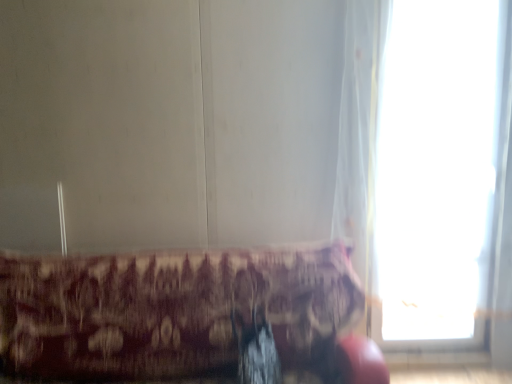
Question: Considering the positions of patterned fabric cushion at lower center and transparent glass window at right in the image, is patterned fabric cushion at lower center wider or thinner than transparent glass window at right?

Choices:
 (A) wide
 (B) thin

Answer: (A)

Question: Is patterned fabric cushion at lower center in front of or behind transparent glass window at right in the image?

Choices:
 (A) behind
 (B) front

Answer: (B)

Question: Considering the positions of patterned fabric cushion at lower center and transparent glass window at right in the image, is patterned fabric cushion at lower center bigger or smaller than transparent glass window at right?

Choices:
 (A) small
 (B) big

Answer: (B)

Question: Relative to patterned fabric cushion at lower center, is transparent glass window at right in front or behind?

Choices:
 (A) behind
 (B) front

Answer: (A)

Question: Considering the positions of transparent glass window at right and patterned fabric cushion at lower center in the image, is transparent glass window at right taller or shorter than patterned fabric cushion at lower center?

Choices:
 (A) short
 (B) tall

Answer: (B)

Question: From a real-world perspective, is transparent glass window at right positioned above or below patterned fabric cushion at lower center?

Choices:
 (A) below
 (B) above

Answer: (B)

Question: From the image's perspective, relative to patterned fabric cushion at lower center, is transparent glass window at right above or below?

Choices:
 (A) below
 (B) above

Answer: (B)